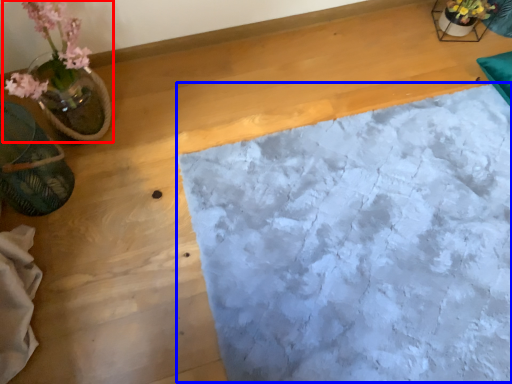
Question: Which of the following is the closest to the observer, houseplant (highlighted by a red box) or sheet (highlighted by a blue box)?

Choices:
 (A) houseplant
 (B) sheet

Answer: (A)